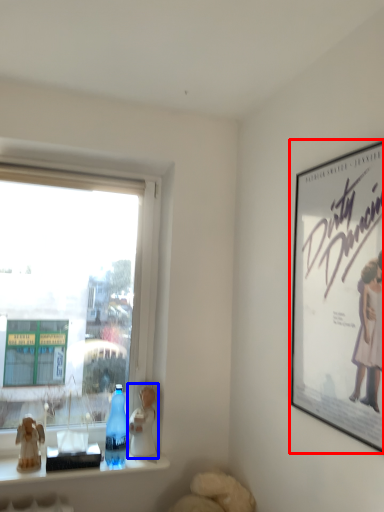
Question: Which object appears farthest to the camera in this image, picture frame (highlighted by a red box) or figurine (highlighted by a blue box)?

Choices:
 (A) picture frame
 (B) figurine

Answer: (B)